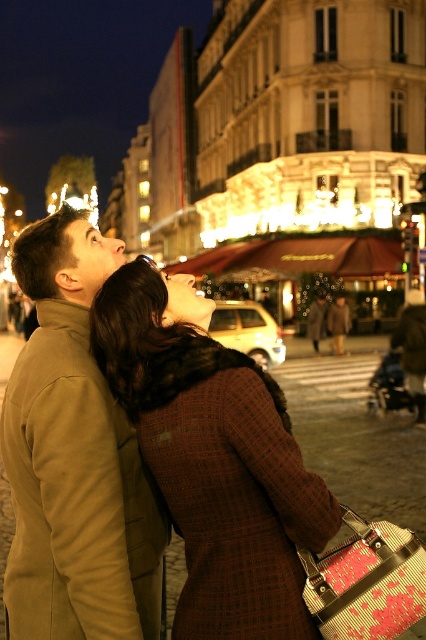
Question: Is tan wool coat at left behind brown wool coat at center?

Choices:
 (A) no
 (B) yes

Answer: (A)

Question: Is tan wool coat at left below brown wool coat at center?

Choices:
 (A) no
 (B) yes

Answer: (B)

Question: Which point is closer to the camera?

Choices:
 (A) (345, 301)
 (B) (118, 340)
 (C) (36, 262)

Answer: (B)

Question: Which of the following is the closest to the observer?

Choices:
 (A) (42, 252)
 (B) (336, 339)

Answer: (A)

Question: Does plaid wool coat at center have a larger size compared to tan wool coat at left?

Choices:
 (A) yes
 (B) no

Answer: (B)

Question: Which point is closer to the camera?

Choices:
 (A) brown wool coat at center
 (B) plaid wool coat at center

Answer: (B)